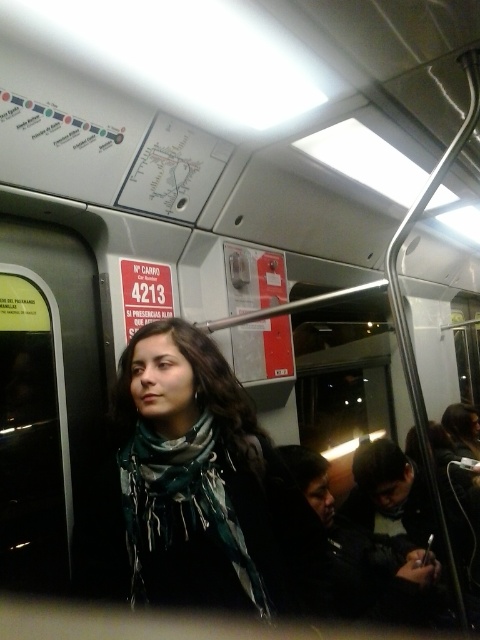
Question: Considering the relative positions of green scarf at center and patterned silk scarf at center in the image provided, where is green scarf at center located with respect to patterned silk scarf at center?

Choices:
 (A) above
 (B) below

Answer: (A)

Question: Is green scarf at center below patterned silk scarf at center?

Choices:
 (A) no
 (B) yes

Answer: (A)

Question: Which point is farther from the camera taking this photo?

Choices:
 (A) (248, 515)
 (B) (153, 481)

Answer: (B)

Question: Is green scarf at center thinner than patterned silk scarf at center?

Choices:
 (A) yes
 (B) no

Answer: (B)